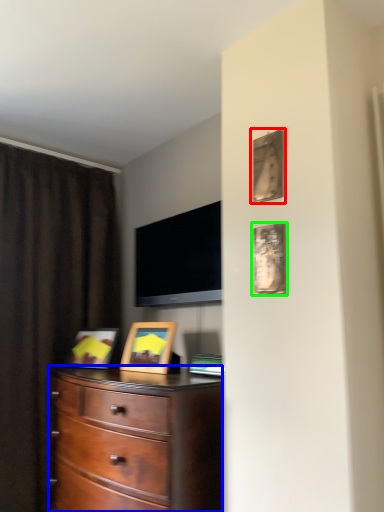
Question: Which object is positioned farthest from picture frame (highlighted by a red box)? Select from chest of drawers (highlighted by a blue box) and picture frame (highlighted by a green box).

Choices:
 (A) chest of drawers
 (B) picture frame

Answer: (A)